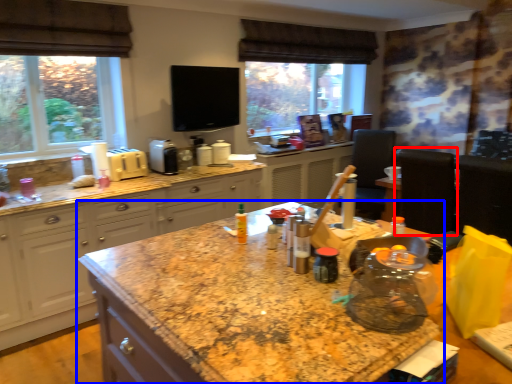
Question: Which of the following is the closest to the observer, chair (highlighted by a red box) or countertop (highlighted by a blue box)?

Choices:
 (A) chair
 (B) countertop

Answer: (B)